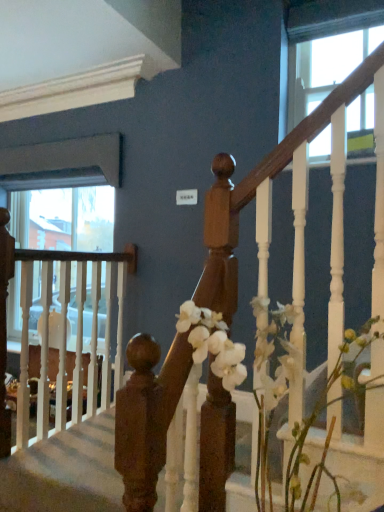
Question: Choose the correct answer: Is wooden handrail at center inside clear glass window at upper right or outside it?

Choices:
 (A) inside
 (B) outside

Answer: (B)

Question: Is wooden handrail at center bigger or smaller than clear glass window at upper right?

Choices:
 (A) small
 (B) big

Answer: (B)

Question: Estimate the real-world distances between objects in this image. Which object is farther from the clear glass window at upper right?

Choices:
 (A) wooden handrail at center
 (B) white matte flowers at center

Answer: (A)

Question: Which object is the farthest from the white matte flowers at center?

Choices:
 (A) clear glass window at upper right
 (B) wooden handrail at center

Answer: (A)